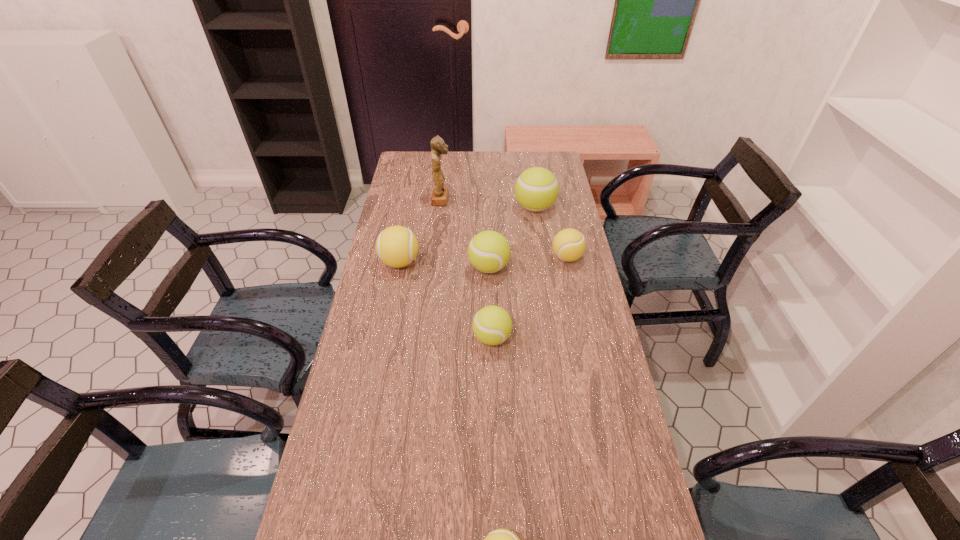
Locate an element on the screen. This screenshot has width=960, height=540. the tallest object is located at coordinates (440, 193).

I want to click on the sixth object from right to left, so click(x=440, y=193).

At what (x,y) coordinates should I click in order to perform the action: click on the farthest tennis ball. Please return your answer as a coordinate pair (x, y). Looking at the image, I should click on (536, 189).

The height and width of the screenshot is (540, 960). In order to click on the sixth shortest object in this screenshot , I will do `click(536, 189)`.

Identify the location of the second biggest green tennis ball. This screenshot has height=540, width=960. (488, 251).

At what (x,y) coordinates should I click in order to perform the action: click on the leftmost yellow tennis ball. Please return your answer as a coordinate pair (x, y). Looking at the image, I should click on (396, 246).

The image size is (960, 540). Identify the location of the leftmost object. (396, 246).

I want to click on the second smallest yellow tennis ball, so click(569, 244).

Image resolution: width=960 pixels, height=540 pixels. In order to click on the nearest green tennis ball in this screenshot , I will do `click(492, 325)`.

Where is `the smallest green tennis ball`? the smallest green tennis ball is located at coordinates (492, 325).